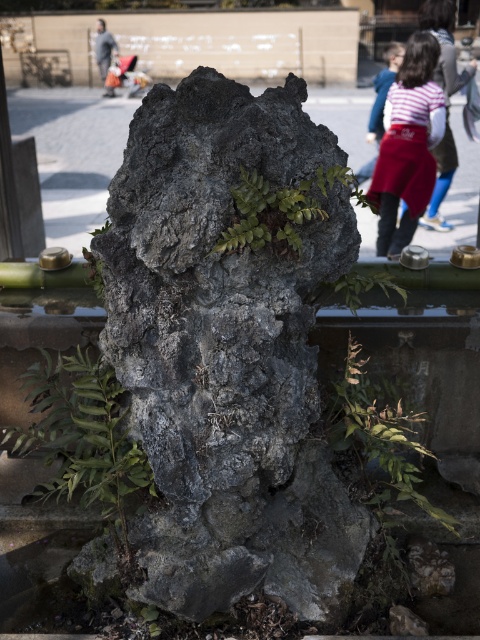
Question: Is green leafy plant at lower left positioned in front of striped cotton shirt at center?

Choices:
 (A) yes
 (B) no

Answer: (A)

Question: Can you confirm if green leafy plant at center is bigger than striped cotton shirt at center?

Choices:
 (A) no
 (B) yes

Answer: (A)

Question: Among these points, which one is farthest from the camera?

Choices:
 (A) (215, 554)
 (B) (100, 44)
 (C) (386, 60)

Answer: (B)

Question: Does green leafy plant at lower left have a larger size compared to gray fabric jacket at upper left?

Choices:
 (A) yes
 (B) no

Answer: (A)

Question: Which object appears farthest from the camera in this image?

Choices:
 (A) rough stone rock at center
 (B) striped cotton shirt at center
 (C) striped cotton shirt at upper right
 (D) striped fabric shirt at upper right

Answer: (B)

Question: Which object is closer to the camera taking this photo?

Choices:
 (A) striped fabric shirt at upper right
 (B) striped cotton shirt at upper right
 (C) striped cotton shirt at center

Answer: (A)